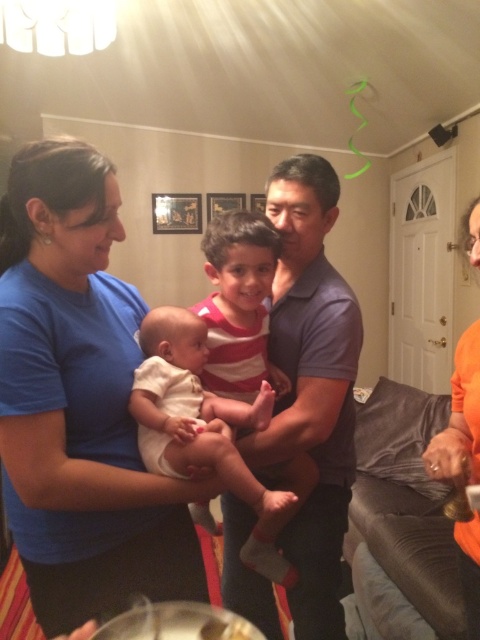
From the picture: You are a photographer setting up for a family photo. You notice the dark blue shirt at center and the striped fabric shirt at center. Which one is closer to the camera?

The dark blue shirt at center is positioned under the striped fabric shirt at center, so the striped fabric shirt at center is closer to the camera.

You are standing in the living room and want to reach the point marked at coordinates (300, 289). If you can move 1.5 meters in one step, how many steps would it take you to reach that point?

The distance between you and the point marked at coordinates (300, 289) is 1.41 meters. Since you can move 1.5 meters in one step, you would only need 1 step to reach the point.

You are a photographer adjusting your camera focus. You need to focus on two specific points in the image, point (14, 321) and point (264, 381). Which point should you focus on first if you want to start with the one closer to the camera?

Point (14, 321) is closer to the camera than point (264, 381), so you should focus on point (14, 321) first.